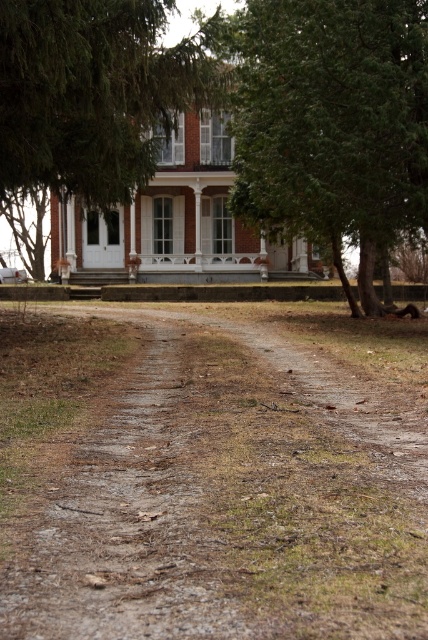
Question: Considering the relative positions of brown gravel path at center and green textured tree at center in the image provided, where is brown gravel path at center located with respect to green textured tree at center?

Choices:
 (A) above
 (B) below

Answer: (B)

Question: Which of the following is the farthest from the observer?

Choices:
 (A) green textured tree at center
 (B) brown gravel path at center

Answer: (A)

Question: Does brown gravel path at center appear over green textured tree at center?

Choices:
 (A) no
 (B) yes

Answer: (A)

Question: Is the position of brown gravel path at center less distant than that of green leafy tree at upper left?

Choices:
 (A) no
 (B) yes

Answer: (B)

Question: Which object appears farthest from the camera in this image?

Choices:
 (A) green leafy tree at upper left
 (B) green textured tree at center
 (C) brown gravel path at center

Answer: (B)

Question: Which object appears farthest from the camera in this image?

Choices:
 (A) brown gravel path at center
 (B) green leafy tree at upper left
 (C) green textured tree at center

Answer: (C)